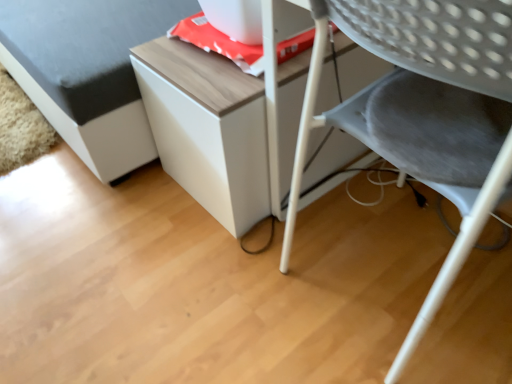
What are the coordinates of `vacant space that's between wooden table at center and gray fabric chair at lower right` in the screenshot? It's located at (335, 205).